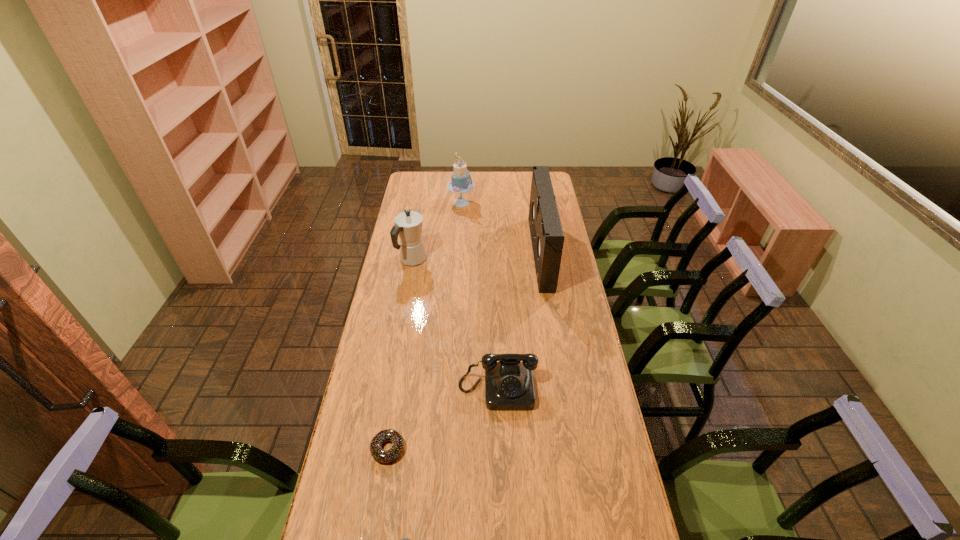
At what (x,y) coordinates should I click in order to perform the action: click on videotape. Please return your answer as a coordinate pair (x, y). Looking at the image, I should click on (x=547, y=236).

The width and height of the screenshot is (960, 540). I want to click on cake, so [460, 183].

Locate an element on the screen. The height and width of the screenshot is (540, 960). coffeepot is located at coordinates (408, 225).

The height and width of the screenshot is (540, 960). Find the location of `telephone`. telephone is located at coordinates (509, 385).

Locate an element on the screen. This screenshot has height=540, width=960. the fourth tallest object is located at coordinates (509, 385).

Identify the location of doughnut. (384, 456).

Identify the location of the fifth farthest object. The image size is (960, 540). (384, 456).

Where is `vacant space located on the side of the rightmost object with visible spindles`? vacant space located on the side of the rightmost object with visible spindles is located at coordinates (492, 253).

I want to click on free space located on the side of the rightmost object with visible spindles, so tap(516, 253).

Locate an element on the screen. The image size is (960, 540). free location located 0.270m on the side of the rightmost object with visible spindles is located at coordinates (474, 253).